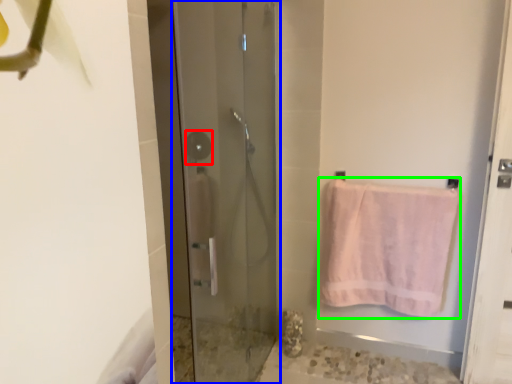
Question: Based on their relative distances, which object is nearer to shower (highlighted by a red box)? Choose from door (highlighted by a blue box) and towel (highlighted by a green box).

Choices:
 (A) door
 (B) towel

Answer: (A)